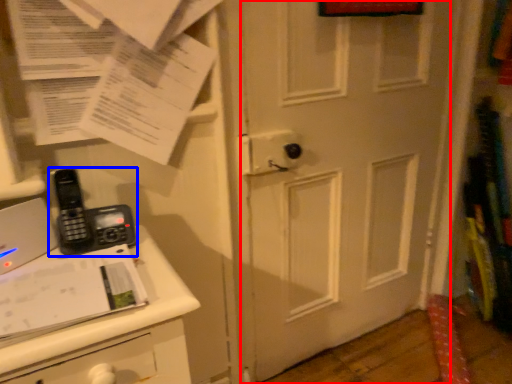
Question: Which object appears farthest to the camera in this image, door (highlighted by a red box) or corded phone (highlighted by a blue box)?

Choices:
 (A) door
 (B) corded phone

Answer: (A)